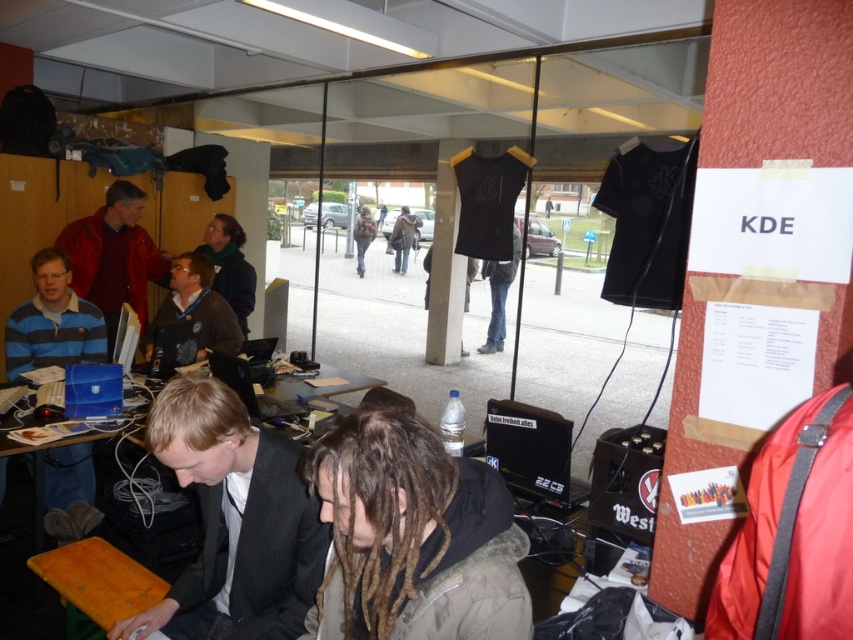
You are standing at the entrance of the workshop and see the striped cotton shirt at left and the dark gray jacket at center. Which one is closer to you?

The striped cotton shirt at left is 8.76 meters away from the dark gray jacket at center, so the dark gray jacket at center is closer to you since it is only 8.76 meters away from the striped cotton shirt at left which is further away.

You are organizing a clothing display and need to arrange the matte red jacket at center and the dark brown leather jacket at center side by side on a shelf. Based on their widths, which jacket should be placed on the left to ensure they fit within the shelf space?

The matte red jacket at center has a lesser width compared to dark brown leather jacket at center, so placing the matte red jacket at center on the left would allow both jackets to fit on the shelf since it takes up less space.